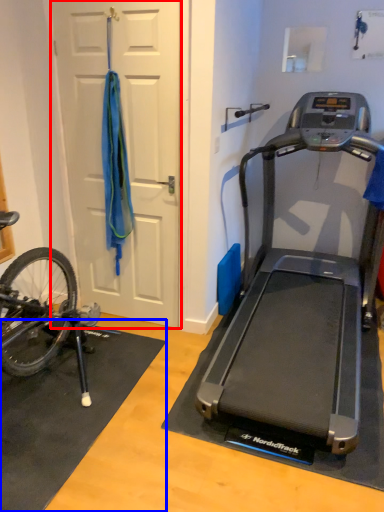
Question: Which object appears closest to the camera in this image, door (highlighted by a red box) or doormat (highlighted by a blue box)?

Choices:
 (A) door
 (B) doormat

Answer: (B)